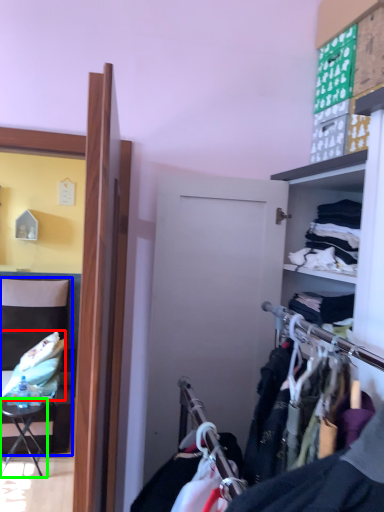
Question: Which is farther away from clothing (highlighted by a red box)? chair (highlighted by a blue box) or table (highlighted by a green box)?

Choices:
 (A) chair
 (B) table

Answer: (A)